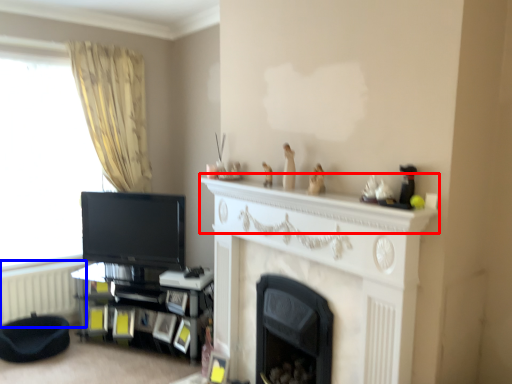
Question: Among these objects, which one is farthest to the camera, mantle (highlighted by a red box) or radiator (highlighted by a blue box)?

Choices:
 (A) mantle
 (B) radiator

Answer: (B)